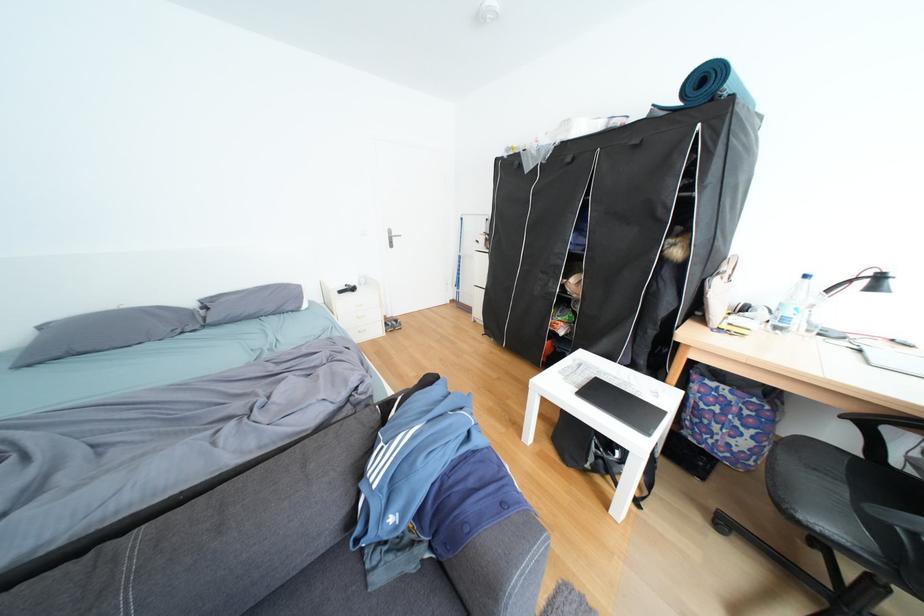
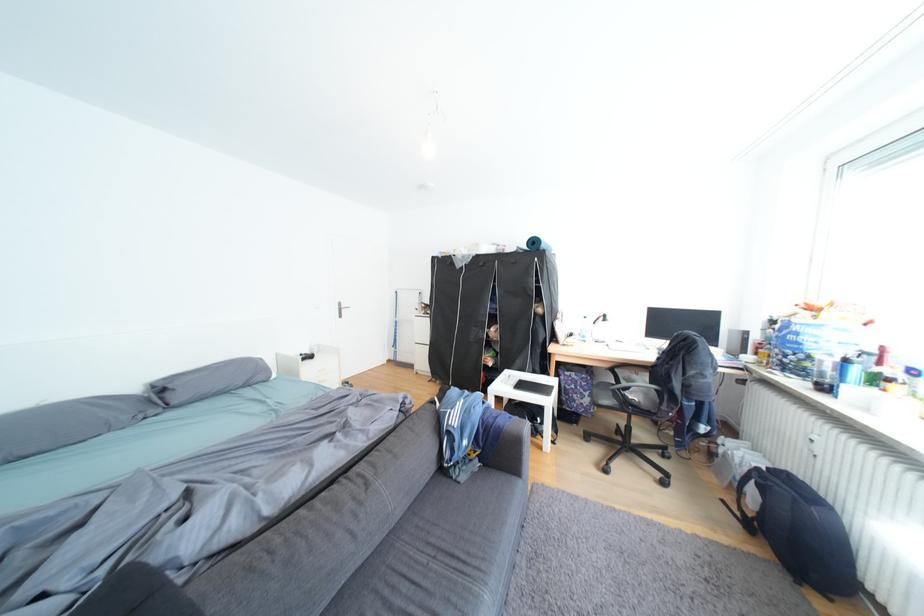
Where in the second image is the point corresponding to (664,334) from the first image?

(552, 352)